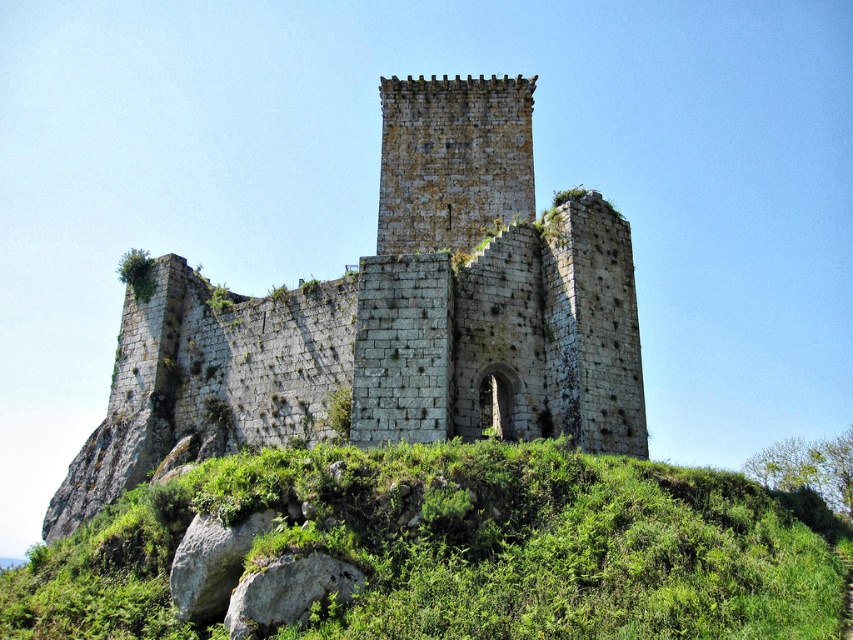
You are an archaeologist examining the medieval ruins. You observe the rusty stone ruins at center and the green grassy at center. Which of these two features has a smaller width?

The rusty stone ruins at center has a smaller width than the green grassy at center.